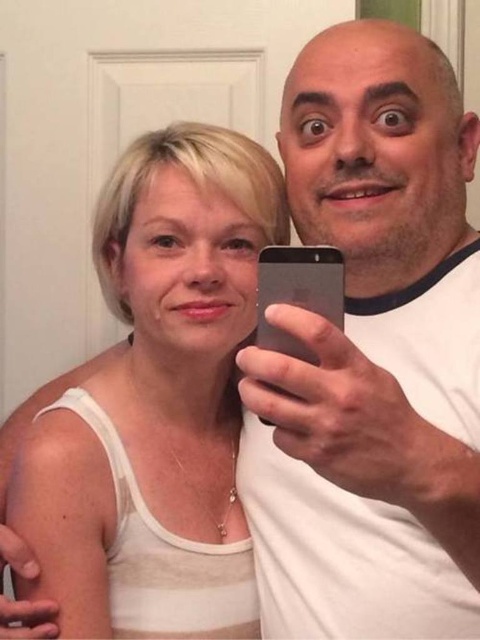
Question: Which of the following is the closest to the observer?

Choices:
 (A) pos(386,444)
 (B) pos(255,340)

Answer: (A)

Question: Considering the relative positions of white matte tank top at center and black glass smartphone at center in the image provided, where is white matte tank top at center located with respect to black glass smartphone at center?

Choices:
 (A) below
 (B) above

Answer: (A)

Question: Can you confirm if white matte phone at center is bigger than black glass smartphone at center?

Choices:
 (A) no
 (B) yes

Answer: (B)

Question: Is white matte phone at center below white matte tank top at center?

Choices:
 (A) no
 (B) yes

Answer: (A)

Question: Which point is closer to the camera?

Choices:
 (A) (123, 625)
 (B) (467, 376)
 (C) (298, 285)

Answer: (C)

Question: Which of these objects is positioned closest to the white matte tank top at center?

Choices:
 (A) white matte phone at center
 (B) black glass smartphone at center

Answer: (A)